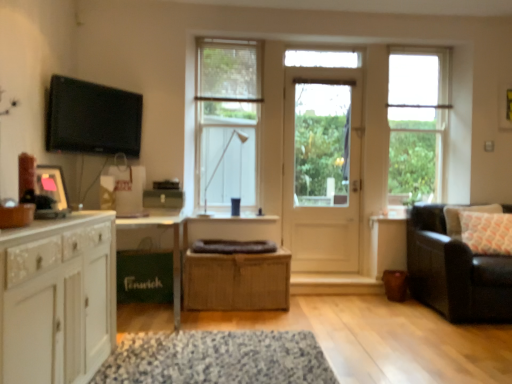
Identify the location of free space to the right of bamboo cabinet at center, the first cabinetry positioned from the right. This screenshot has height=384, width=512. (322, 316).